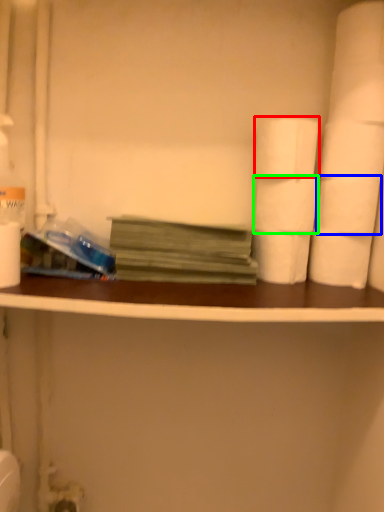
Question: Estimate the real-world distances between objects in this image. Which object is farther from toilet paper (highlighted by a red box), toilet paper (highlighted by a blue box) or toilet paper (highlighted by a green box)?

Choices:
 (A) toilet paper
 (B) toilet paper

Answer: (A)